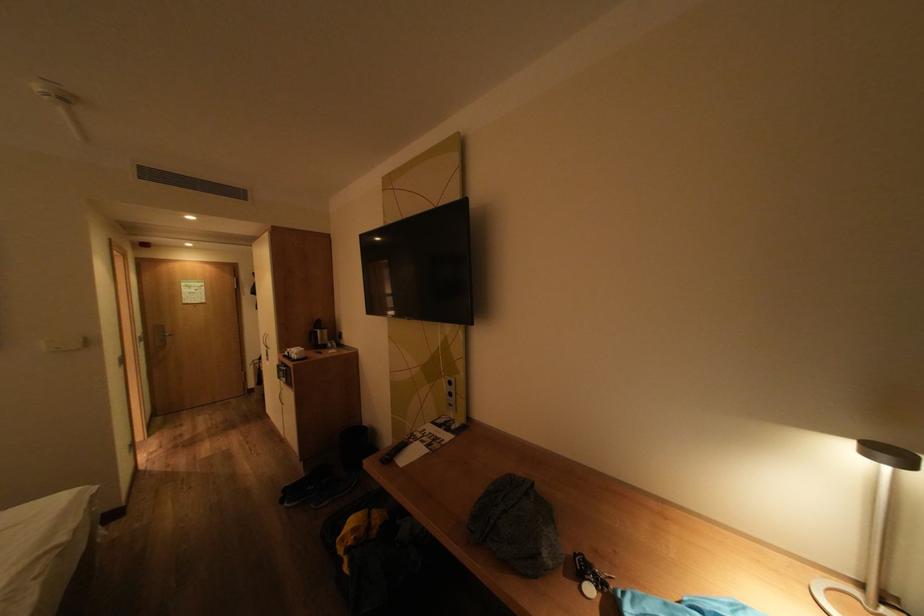
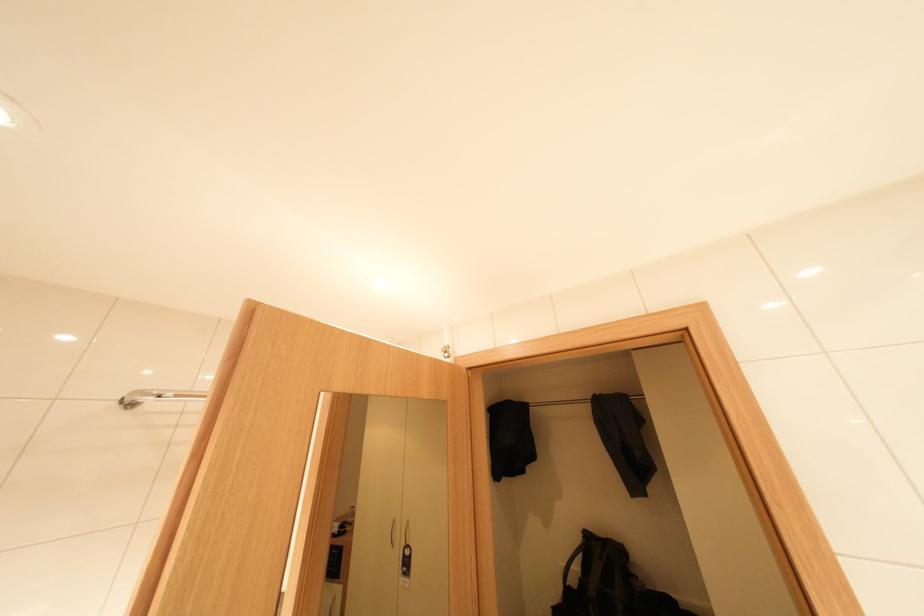
What movement of the cameraman would produce the second image?

The movement direction of the cameraman is left, forward.